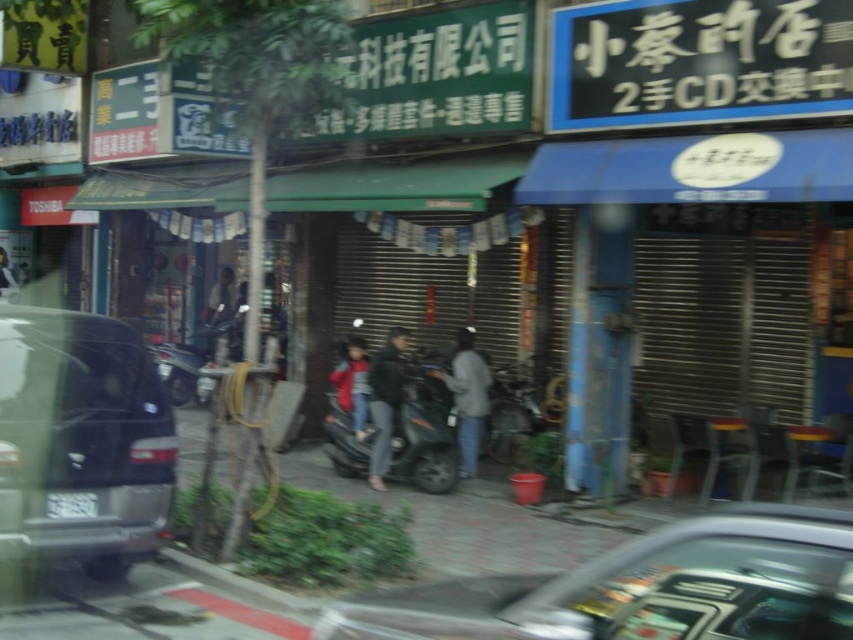
You are navigating a delivery drone that needs to fly from the point at coordinates point (x=845, y=582) to point (x=366, y=406). According to the scene, will the drone have to fly over any obstacles between these two points?

Point (x=845, y=582) is in front of point (x=366, y=406), so the drone will have to fly over the parked car on the left side and the three individuals near the motorbike on the sidewalk, which are located between these two points.

You are a fashion designer observing the image. You need to determine which item is wider between the red velvet coat at center and the black plastic license plate at center. Which one is wider?

The red velvet coat at center is wider than the black plastic license plate at center according to the description.